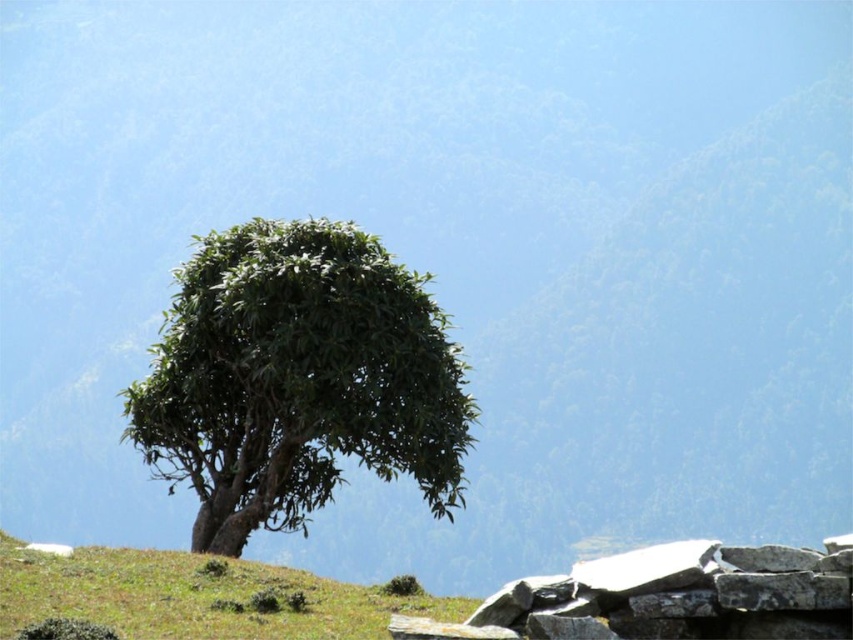
You are a gardener planning to plant a new tree in the area. Given the space available, which object in the scene indicates that the green leafy tree at center can grow wider without encroaching on the green grassy at lower left?

The green leafy tree at center is currently narrower than the green grassy at lower left, so there is enough space for it to grow wider without affecting the green grassy at lower left.

You are standing in the landscape and want to walk from the green grassy at lower left to the green leafy tree at center. Which direction should you move to get closer to the tree?

The green leafy tree at center is further to the viewer than the green grassy at lower left, so you should move forward towards the tree to get closer.

You are standing at the top of the hill and want to walk down to the green grassy at lower left. Which direction should you head relative to the green leafy tree at center?

You should head to the right of the green leafy tree at center because the green grassy at lower left is located to the left of the tree, so moving right from the tree would lead you down towards the grassy area.